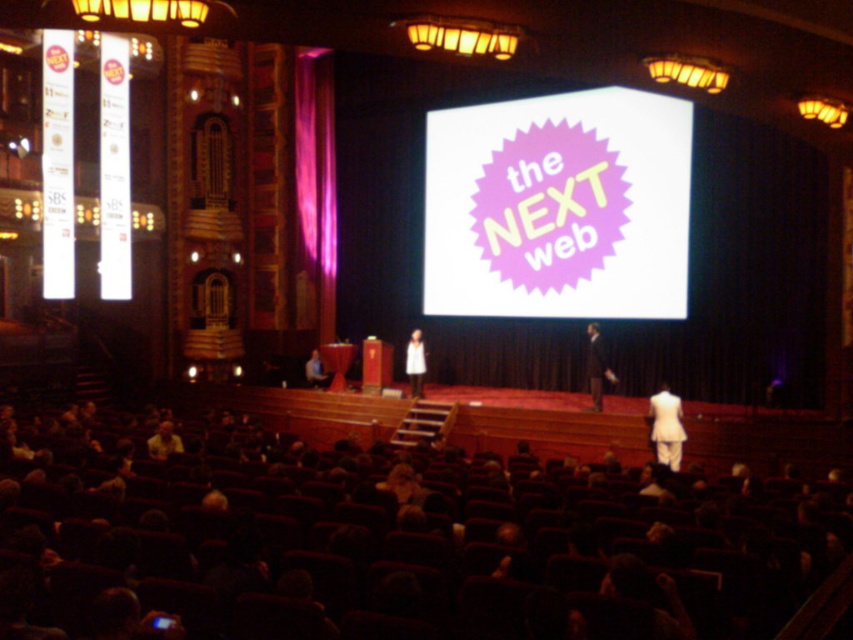
Question: Does white suit at center come behind light brown leather jacket at lower center?

Choices:
 (A) no
 (B) yes

Answer: (A)

Question: From the image, what is the correct spatial relationship of dark brown leather chair at center in relation to pink velvet curtain at center?

Choices:
 (A) below
 (B) above

Answer: (A)

Question: Which point is closer to the camera?

Choices:
 (A) (340, 572)
 (B) (416, 330)
 (C) (306, 234)
 (D) (175, 448)

Answer: (A)

Question: Which point is closer to the camera?

Choices:
 (A) dark brown leather chair at center
 (B) light brown leather jacket at lower left
 (C) white fabric dress at lower right
 (D) pink velvet curtain at center

Answer: (A)

Question: Considering the real-world distances, which object is closest to the dark brown leather chair at center?

Choices:
 (A) pink velvet curtain at center
 (B) light brown leather jacket at lower center
 (C) light brown leather jacket at lower left

Answer: (C)

Question: Can you confirm if white suit at center is smaller than light brown leather jacket at lower left?

Choices:
 (A) yes
 (B) no

Answer: (B)